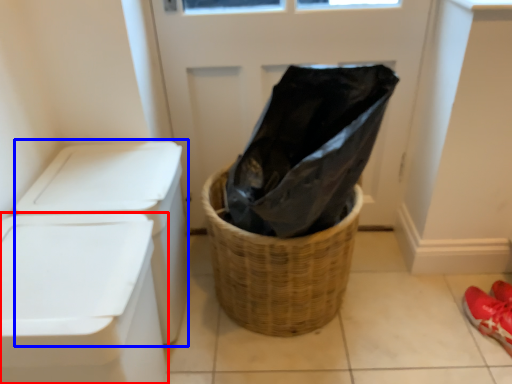
Question: Which object is closer to the camera taking this photo, waste container (highlighted by a red box) or washer (highlighted by a blue box)?

Choices:
 (A) waste container
 (B) washer

Answer: (A)